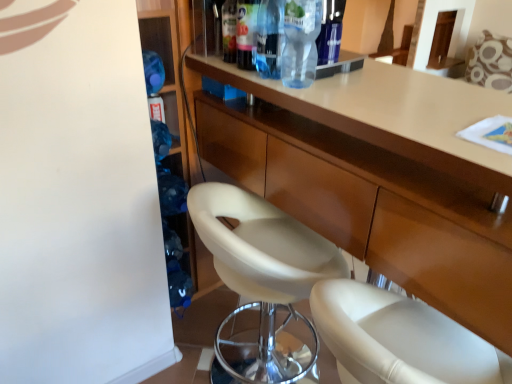
Locate an element on the screen. The image size is (512, 384). vacant area that is in front of transparent plastic bottle at upper center, which ranks as the 2th bottle in left-to-right order is located at coordinates [291, 90].